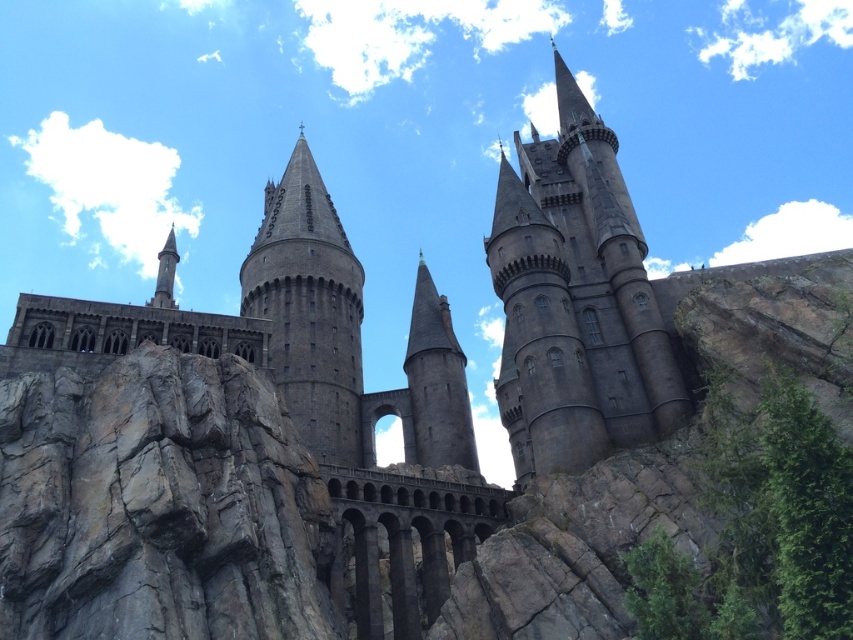
Question: Is gray rough rock at center above smooth gray stone tower at center?

Choices:
 (A) no
 (B) yes

Answer: (A)

Question: Does gray rough rock at center appear on the left side of smooth gray stone tower at center?

Choices:
 (A) yes
 (B) no

Answer: (A)

Question: Considering the relative positions of gray rough rock at center and dark stone tower at center in the image provided, where is gray rough rock at center located with respect to dark stone tower at center?

Choices:
 (A) above
 (B) below

Answer: (B)

Question: Which of these objects is positioned farthest from the dark stone tower at center?

Choices:
 (A) smooth gray stone tower at center
 (B) dark gray stone tower at center

Answer: (B)

Question: Which point is farther from the camera taking this photo?

Choices:
 (A) (674, 410)
 (B) (332, 284)
 (C) (115, 451)

Answer: (B)

Question: Which object is farther from the camera taking this photo?

Choices:
 (A) gray rough rock at center
 (B) dark gray stone tower at center
 (C) dark stone tower at center
 (D) smooth gray stone tower at center

Answer: (D)